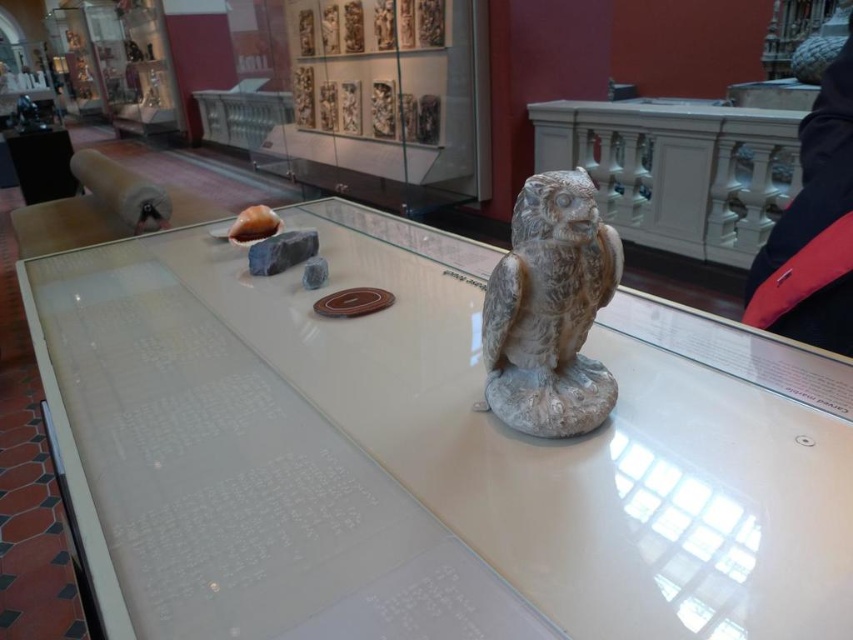
Question: Does white glossy table at center appear under white stone owl at center?

Choices:
 (A) no
 (B) yes

Answer: (B)

Question: Which point appears farthest from the camera in this image?

Choices:
 (A) (167, 353)
 (B) (488, 291)

Answer: (A)

Question: In this image, where is white glossy table at center located relative to white stone owl at center?

Choices:
 (A) right
 (B) left

Answer: (B)

Question: Which point is closer to the camera?

Choices:
 (A) (331, 289)
 (B) (497, 339)

Answer: (B)

Question: Is white glossy table at center bigger than white stone owl at center?

Choices:
 (A) no
 (B) yes

Answer: (B)